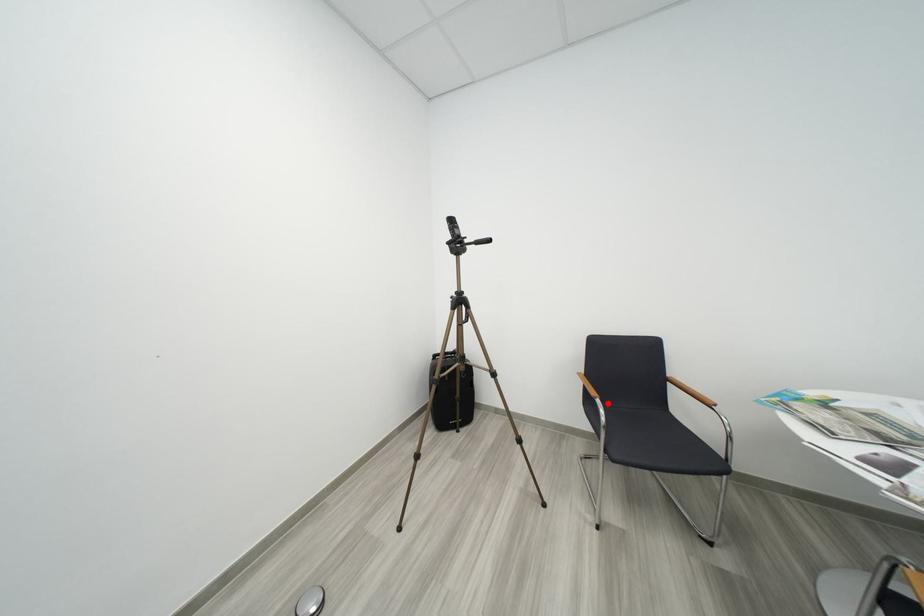
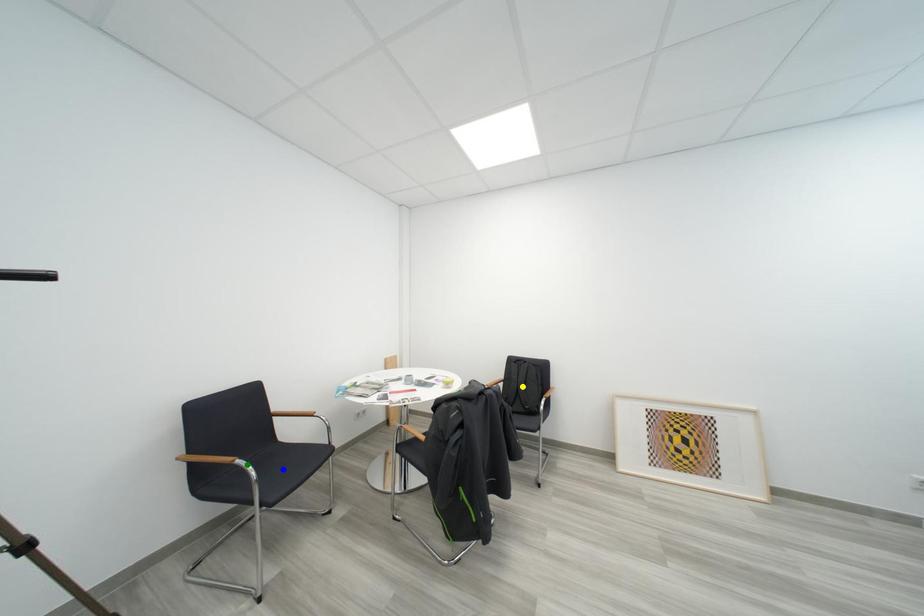
Question: I am providing you with two images of the same scene from different viewpoints. A red point is marked on the first image. You are given multiple points on the second image. Can you choose the point in image 2 that corresponds to the point in image 1?

Choices:
 (A) yellow point
 (B) blue point
 (C) green point

Answer: (C)